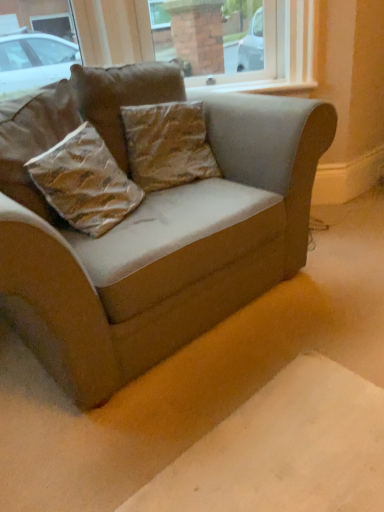
This screenshot has height=512, width=384. Find the location of `brown textured pillow at center, the 2th pillow from the top`. brown textured pillow at center, the 2th pillow from the top is located at coordinates (168, 145).

This screenshot has width=384, height=512. I want to click on brown textured pillow at center, acting as the third pillow starting from the top, so click(x=85, y=182).

Is brown textured pillow at center, acting as the third pillow starting from the top, outside of brown textured pillow at center, which appears as the 1th pillow when viewed from the top?

That's correct, brown textured pillow at center, acting as the third pillow starting from the top, is outside of brown textured pillow at center, which appears as the 1th pillow when viewed from the top.

Is brown textured pillow at center, the first pillow when ordered from bottom to top, far away from brown textured pillow at center, which appears as the 1th pillow when viewed from the top?

They are positioned close to each other.

Is brown textured pillow at center, acting as the third pillow starting from the top, shorter than brown textured pillow at center, which appears as the 1th pillow when viewed from the top?

Yes.

Is brown textured pillow at center, acting as the third pillow starting from the top, facing away from brown textured pillow at center, the 3th pillow ordered from the bottom?

No, brown textured pillow at center, acting as the third pillow starting from the top, is not facing the opposite direction of brown textured pillow at center, the 3th pillow ordered from the bottom.

From the image's perspective, would you say brown textured pillow at center, the 3th pillow ordered from the bottom, is shown under brown textured pillow at center, the first pillow when ordered from bottom to top?

No.

Which of these two, brown textured pillow at center, the 3th pillow ordered from the bottom, or brown textured pillow at center, the first pillow when ordered from bottom to top, stands shorter?

brown textured pillow at center, the first pillow when ordered from bottom to top.

From the picture: In terms of width, does brown textured pillow at center, which appears as the 1th pillow when viewed from the top, look wider or thinner when compared to brown textured pillow at center, the first pillow when ordered from bottom to top?

Clearly, brown textured pillow at center, which appears as the 1th pillow when viewed from the top, has less width compared to brown textured pillow at center, the first pillow when ordered from bottom to top.

From the image's perspective, count 2nd pillows upward from the brown textured pillow at center, the first pillow when ordered from bottom to top, and point to it. Please provide its 2D coordinates.

[(123, 97)]

Consider the image. Based on their sizes in the image, would you say velvet beige couch at center is bigger or smaller than brown textured pillow at center, which appears as the 1th pillow when viewed from the top?

Considering their sizes, velvet beige couch at center takes up more space than brown textured pillow at center, which appears as the 1th pillow when viewed from the top.

From a real-world perspective, which object stands above the other?

brown textured pillow at center, which appears as the 1th pillow when viewed from the top.

What's the angular difference between velvet beige couch at center and brown textured pillow at center, which appears as the 1th pillow when viewed from the top,'s facing directions?

The facing directions of velvet beige couch at center and brown textured pillow at center, which appears as the 1th pillow when viewed from the top, are 7.7 degrees apart.

Choose the correct answer: Is velvet beige couch at center inside brown textured pillow at center, the 3th pillow ordered from the bottom, or outside it?

velvet beige couch at center is not enclosed by brown textured pillow at center, the 3th pillow ordered from the bottom.

In the scene shown: How many degrees apart are the facing directions of brown textured pillow at center, the 3th pillow ordered from the bottom, and velvet beige couch at center?

There is a 7.7-degree angle between the facing directions of brown textured pillow at center, the 3th pillow ordered from the bottom, and velvet beige couch at center.

Are brown textured pillow at center, the 3th pillow ordered from the bottom, and velvet beige couch at center located far from each other?

They are positioned close to each other.

Considering the sizes of objects brown textured pillow at center, which appears as the 1th pillow when viewed from the top, and velvet beige couch at center in the image provided, who is taller, brown textured pillow at center, which appears as the 1th pillow when viewed from the top, or velvet beige couch at center?

velvet beige couch at center.

Is brown textured pillow at center, which appears as the 1th pillow when viewed from the top, facing away from velvet beige couch at center?

Yes, brown textured pillow at center, which appears as the 1th pillow when viewed from the top,'s orientation is away from velvet beige couch at center.

Between point (156, 182) and point (325, 111), which one is positioned behind?

The point (156, 182) is behind.

Is brown textured pillow at center, which is counted as the 2th pillow, starting from the bottom, far away from velvet beige couch at center?

No, there isn't a large distance between brown textured pillow at center, which is counted as the 2th pillow, starting from the bottom, and velvet beige couch at center.

This screenshot has width=384, height=512. I want to click on studio couch lying below the brown textured pillow at center, the 2th pillow from the top (from the image's perspective), so click(166, 250).

How many degrees apart are the facing directions of brown textured pillow at center, which is counted as the 2th pillow, starting from the bottom, and velvet beige couch at center?

The angular difference between brown textured pillow at center, which is counted as the 2th pillow, starting from the bottom, and velvet beige couch at center is 17.3 degrees.

Is brown textured pillow at center, the 2th pillow from the top, at the left side of brown textured pillow at center, the first pillow when ordered from bottom to top?

In fact, brown textured pillow at center, the 2th pillow from the top, is to the right of brown textured pillow at center, the first pillow when ordered from bottom to top.

Between brown textured pillow at center, which is counted as the 2th pillow, starting from the bottom, and brown textured pillow at center, the first pillow when ordered from bottom to top, which one has less height?

brown textured pillow at center, the first pillow when ordered from bottom to top, is shorter.

Would you say brown textured pillow at center, which is counted as the 2th pillow, starting from the bottom, is a long distance from brown textured pillow at center, the first pillow when ordered from bottom to top?

No, brown textured pillow at center, which is counted as the 2th pillow, starting from the bottom, is in close proximity to brown textured pillow at center, the first pillow when ordered from bottom to top.

From the image's perspective, is brown textured pillow at center, which is counted as the 2th pillow, starting from the bottom, located above brown textured pillow at center, acting as the third pillow starting from the top?

Yes.

Considering the sizes of objects brown textured pillow at center, which is counted as the 2th pillow, starting from the bottom, and brown textured pillow at center, which appears as the 1th pillow when viewed from the top, in the image provided, who is shorter, brown textured pillow at center, which is counted as the 2th pillow, starting from the bottom, or brown textured pillow at center, which appears as the 1th pillow when viewed from the top,?

brown textured pillow at center, which is counted as the 2th pillow, starting from the bottom, is shorter.

From a real-world perspective, does brown textured pillow at center, the 2th pillow from the top, stand above brown textured pillow at center, which appears as the 1th pillow when viewed from the top?

No, from a real-world perspective, brown textured pillow at center, the 2th pillow from the top, is not over brown textured pillow at center, which appears as the 1th pillow when viewed from the top

Is brown textured pillow at center, which is counted as the 2th pillow, starting from the bottom, located outside brown textured pillow at center, which appears as the 1th pillow when viewed from the top?

Yes, brown textured pillow at center, which is counted as the 2th pillow, starting from the bottom, is located beyond the bounds of brown textured pillow at center, which appears as the 1th pillow when viewed from the top.

Can you confirm if brown textured pillow at center, the 2th pillow from the top, is positioned to the right of brown textured pillow at center, which appears as the 1th pillow when viewed from the top?

Yes.

Which pillow is the 1st one when counting from the back of the brown textured pillow at center, acting as the third pillow starting from the top? Please provide its 2D coordinates.

[(123, 97)]

In order to click on pillow in front of the brown textured pillow at center, which appears as the 1th pillow when viewed from the top in this screenshot , I will do `click(85, 182)`.

From the image, which object appears to be farther from velvet beige couch at center, brown textured pillow at center, acting as the third pillow starting from the top, or brown textured pillow at center, the 3th pillow ordered from the bottom?

→ Among the two, brown textured pillow at center, the 3th pillow ordered from the bottom, is located further to velvet beige couch at center.

Based on their spatial positions, is velvet beige couch at center or brown textured pillow at center, the 2th pillow from the top, further from brown textured pillow at center, acting as the third pillow starting from the top?

Based on the image, brown textured pillow at center, the 2th pillow from the top, appears to be further to brown textured pillow at center, acting as the third pillow starting from the top.

Considering their positions, is velvet beige couch at center positioned closer to brown textured pillow at center, which appears as the 1th pillow when viewed from the top, than brown textured pillow at center, acting as the third pillow starting from the top?

Based on the image, brown textured pillow at center, acting as the third pillow starting from the top, appears to be nearer to brown textured pillow at center, which appears as the 1th pillow when viewed from the top.

Based on the photo, estimate the real-world distances between objects in this image. Which object is closer to brown textured pillow at center, the 2th pillow from the top, brown textured pillow at center, acting as the third pillow starting from the top, or velvet beige couch at center?

brown textured pillow at center, acting as the third pillow starting from the top, lies closer to brown textured pillow at center, the 2th pillow from the top, than the other object.

Estimate the real-world distances between objects in this image. Which object is further from brown textured pillow at center, the 2th pillow from the top, velvet beige couch at center or brown textured pillow at center, the first pillow when ordered from bottom to top?

velvet beige couch at center is positioned further to the anchor brown textured pillow at center, the 2th pillow from the top.

When comparing their distances from brown textured pillow at center, which is counted as the 2th pillow, starting from the bottom, does brown textured pillow at center, which appears as the 1th pillow when viewed from the top, or brown textured pillow at center, acting as the third pillow starting from the top, seem further?

brown textured pillow at center, acting as the third pillow starting from the top, is further to brown textured pillow at center, which is counted as the 2th pillow, starting from the bottom.

From the image, which object appears to be nearer to brown textured pillow at center, the first pillow when ordered from bottom to top, brown textured pillow at center, the 2th pillow from the top, or brown textured pillow at center, the 3th pillow ordered from the bottom?

Among the two, brown textured pillow at center, the 3th pillow ordered from the bottom, is located nearer to brown textured pillow at center, the first pillow when ordered from bottom to top.

Based on their spatial positions, is velvet beige couch at center or brown textured pillow at center, which appears as the 1th pillow when viewed from the top, closer to brown textured pillow at center, the 2th pillow from the top?

brown textured pillow at center, which appears as the 1th pillow when viewed from the top, lies closer to brown textured pillow at center, the 2th pillow from the top, than the other object.

Find the location of a particular element. pillow between brown textured pillow at center, acting as the third pillow starting from the top, and brown textured pillow at center, which is counted as the 2th pillow, starting from the bottom, from front to back is located at coordinates (123, 97).

Locate an element on the screen. The image size is (384, 512). pillow between velvet beige couch at center and brown textured pillow at center, which appears as the 1th pillow when viewed from the top, along the z-axis is located at coordinates (85, 182).